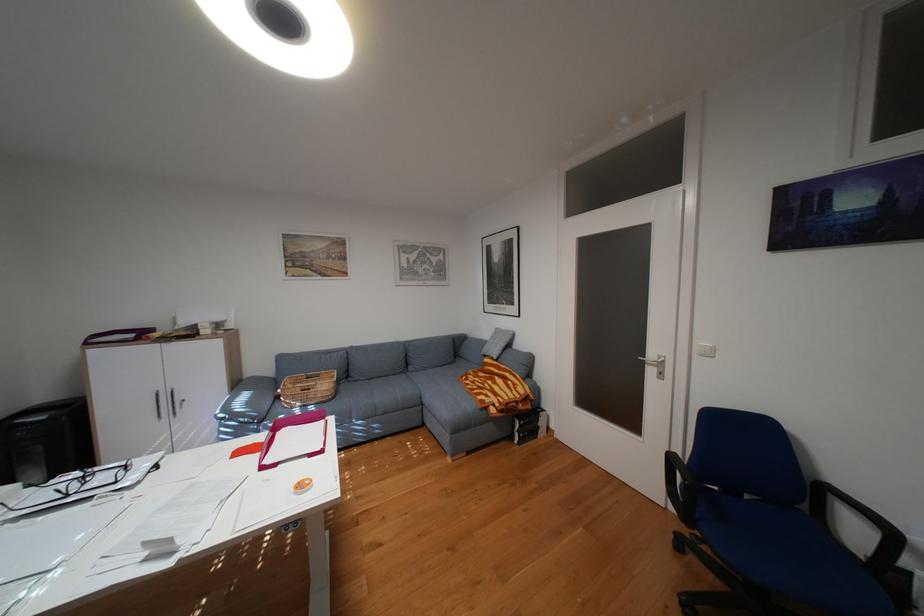
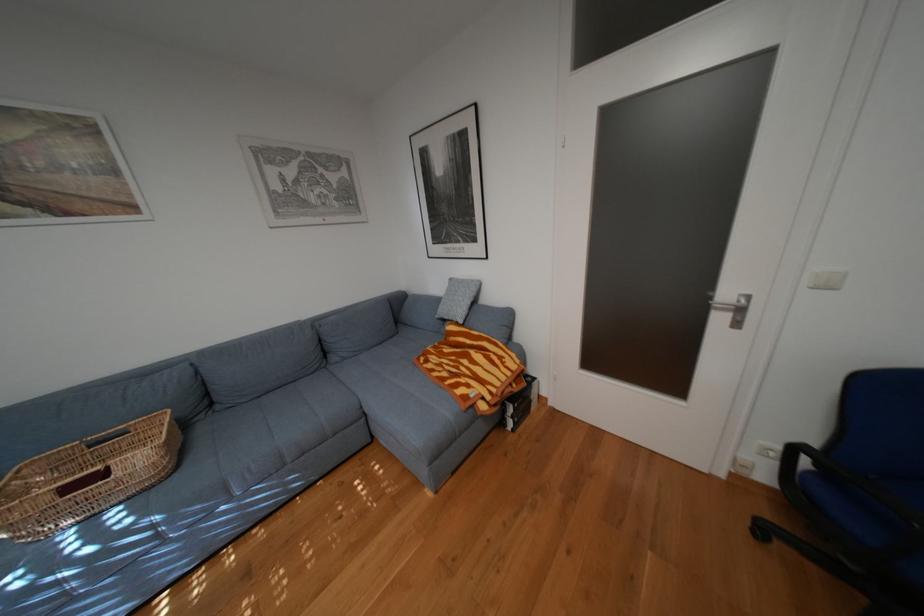
Question: What movement of the cameraman would produce the second image?

Choices:
 (A) Left
 (B) Right
 (C) Forward
 (D) Backward

Answer: (C)